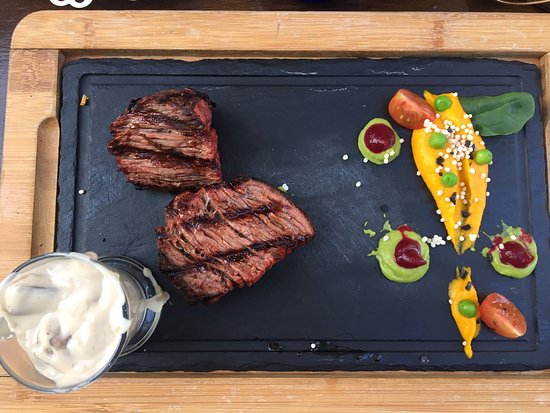
Where is `cups`? The width and height of the screenshot is (550, 413). cups is located at coordinates (138, 312).